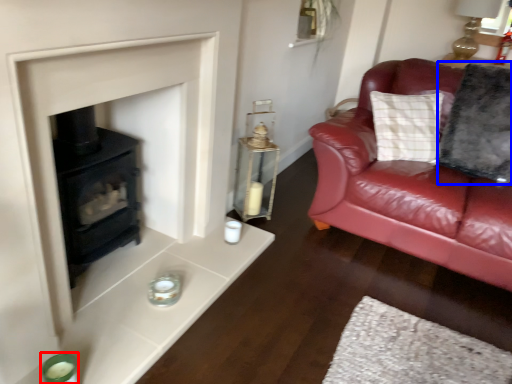
Question: Which of the following is the farthest to the observer, candle holder (highlighted by a red box) or pillow (highlighted by a blue box)?

Choices:
 (A) candle holder
 (B) pillow

Answer: (B)